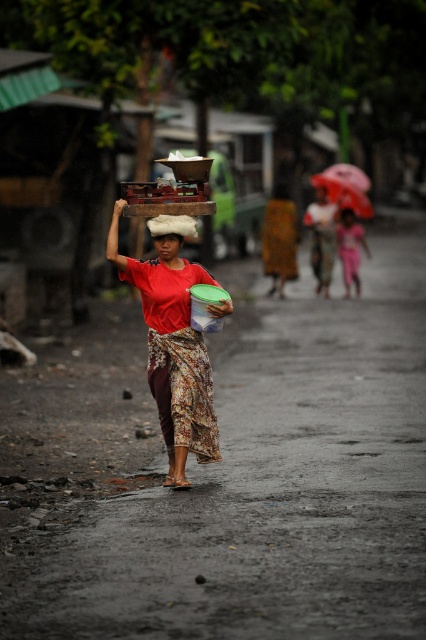
In the scene shown: Between matte red shirt at center and smooth plastic head at center, which one has more height?

With more height is matte red shirt at center.

Between matte red shirt at center and smooth plastic head at center, which one is positioned lower?

matte red shirt at center

Is point (196, 369) positioned after point (350, 209)?

No, (196, 369) is in front of (350, 209).

Locate an element on the screen. This screenshot has width=426, height=640. matte red shirt at center is located at coordinates point(172,346).

Does red fabric umbrella at upper right have a greater height compared to smooth plastic head at center?

Yes, red fabric umbrella at upper right is taller than smooth plastic head at center.

What do you see at coordinates (345, 188) in the screenshot? This screenshot has height=640, width=426. I see `red fabric umbrella at upper right` at bounding box center [345, 188].

Who is more forward, (340, 205) or (350, 220)?

Positioned in front is point (350, 220).

What are the coordinates of `red fabric umbrella at upper right` in the screenshot? It's located at (345, 188).

Locate an element on the screen. The height and width of the screenshot is (640, 426). matte red shirt at center is located at coordinates (172, 346).

Who is higher up, matte red shirt at center or red fabric umbrella at upper right?

Positioned higher is red fabric umbrella at upper right.

Which is in front, point (152, 282) or point (330, 186)?

Point (152, 282)

Locate an element on the screen. The image size is (426, 640). matte red shirt at center is located at coordinates (172, 346).